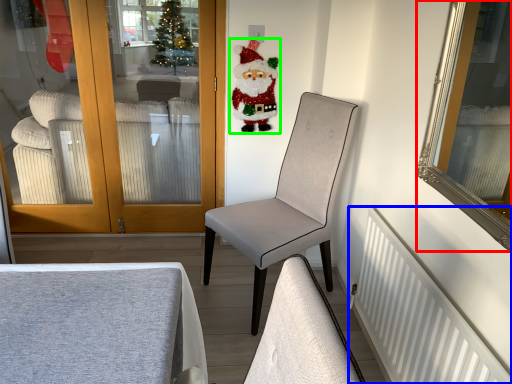
Question: Which object is positioned farthest from mirror (highlighted by a red box)? Select from radiator (highlighted by a blue box) and santa claus (highlighted by a green box).

Choices:
 (A) radiator
 (B) santa claus

Answer: (A)